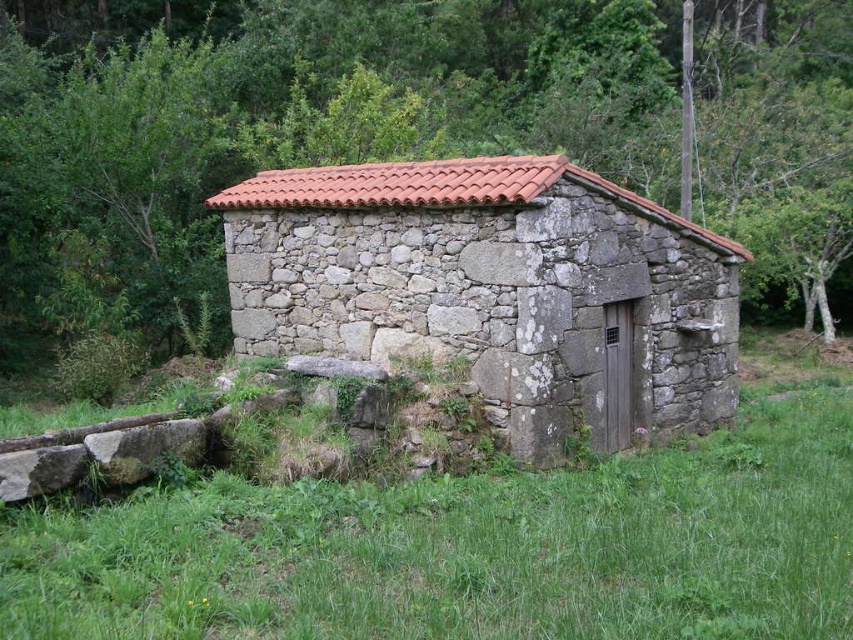
Question: Which object is farther from the camera taking this photo?

Choices:
 (A) stone textured hut at center
 (B) green leafy tree at center

Answer: (B)

Question: Which object is farther from the camera taking this photo?

Choices:
 (A) stone textured hut at center
 (B) green leafy tree at center
 (C) green leafy tree at upper left

Answer: (C)

Question: Does green leafy tree at center have a greater width compared to green leafy tree at upper left?

Choices:
 (A) yes
 (B) no

Answer: (A)

Question: Which object is closer to the camera taking this photo?

Choices:
 (A) green leafy tree at center
 (B) stone textured hut at center
 (C) green leafy tree at upper left

Answer: (B)

Question: Can you confirm if stone textured hut at center is bigger than green leafy tree at upper left?

Choices:
 (A) no
 (B) yes

Answer: (B)

Question: Observing the image, what is the correct spatial positioning of green leafy tree at center in reference to green leafy tree at upper left?

Choices:
 (A) right
 (B) left

Answer: (A)